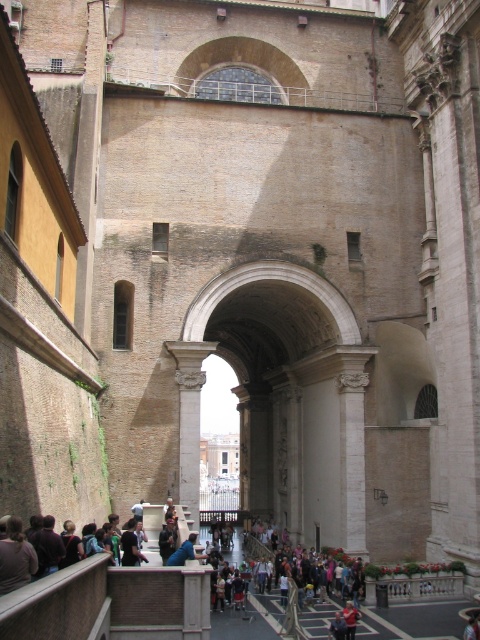
You are a visitor standing at the entrance of the grand architectural scene. You see blue denim jeans at center and dark blue fabric at center. Which object is placed on top of the other?

The blue denim jeans at center is positioned over dark blue fabric at center, so the blue denim jeans at center is placed on top of the dark blue fabric at center.

You are a tour guide explaining the architecture of the building. You notice two items at the center of the scene, the blue denim jeans at center and the dark blue fabric at center. Which one is bigger in size?

The blue denim jeans at center is larger in size than the dark blue fabric at center.